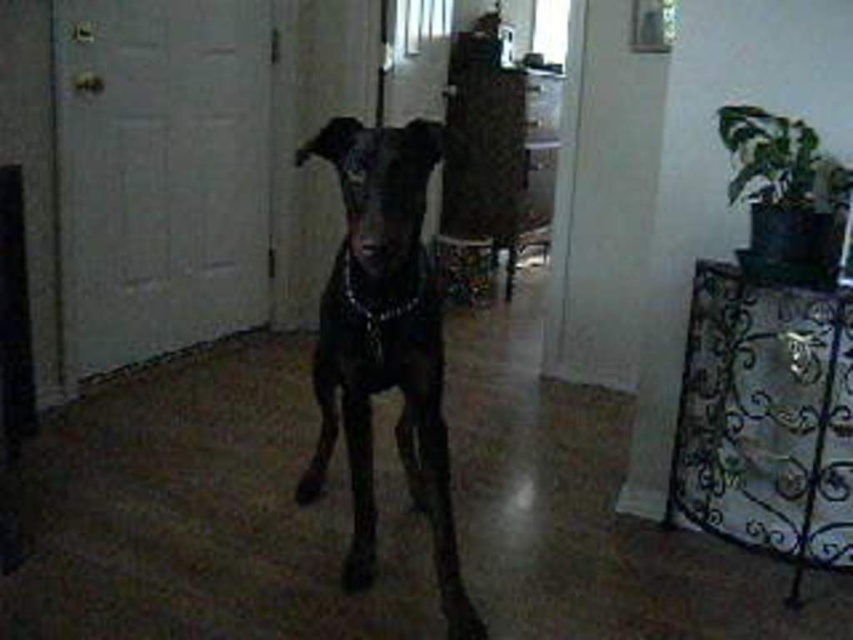
Question: Can you confirm if shiny black dog at center is bigger than black chain at center?

Choices:
 (A) no
 (B) yes

Answer: (B)

Question: Is shiny black dog at center below black chain at center?

Choices:
 (A) no
 (B) yes

Answer: (B)

Question: In this image, where is shiny black dog at center located relative to black chain at center?

Choices:
 (A) above
 (B) below

Answer: (B)

Question: Which point appears closest to the camera in this image?

Choices:
 (A) (419, 301)
 (B) (402, 182)

Answer: (B)